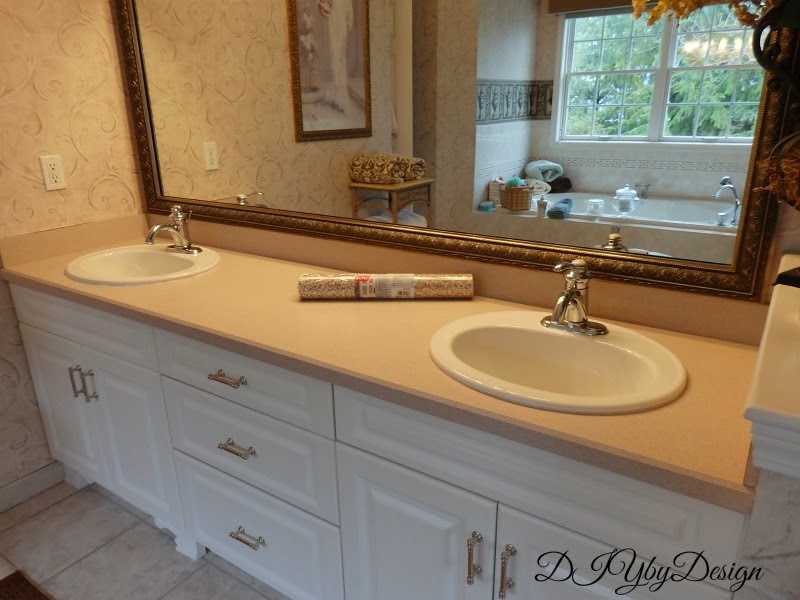
What are the coordinates of `cabinets` in the screenshot? It's located at (132, 397), (58, 406), (404, 533), (525, 580).